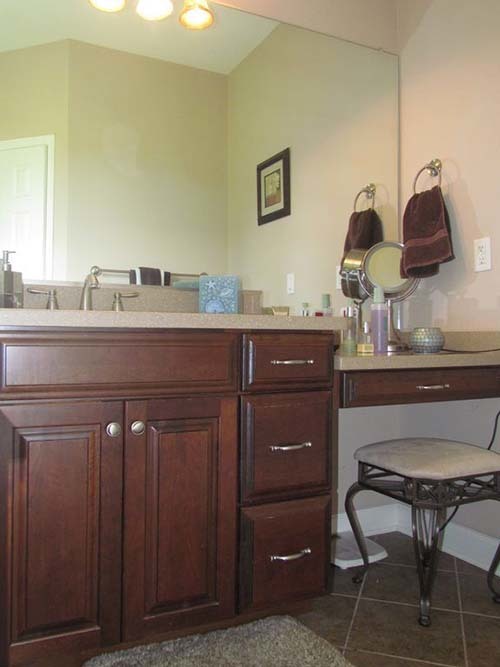
Find the location of `lights`. lights is located at coordinates (183, 17), (150, 9), (105, 3).